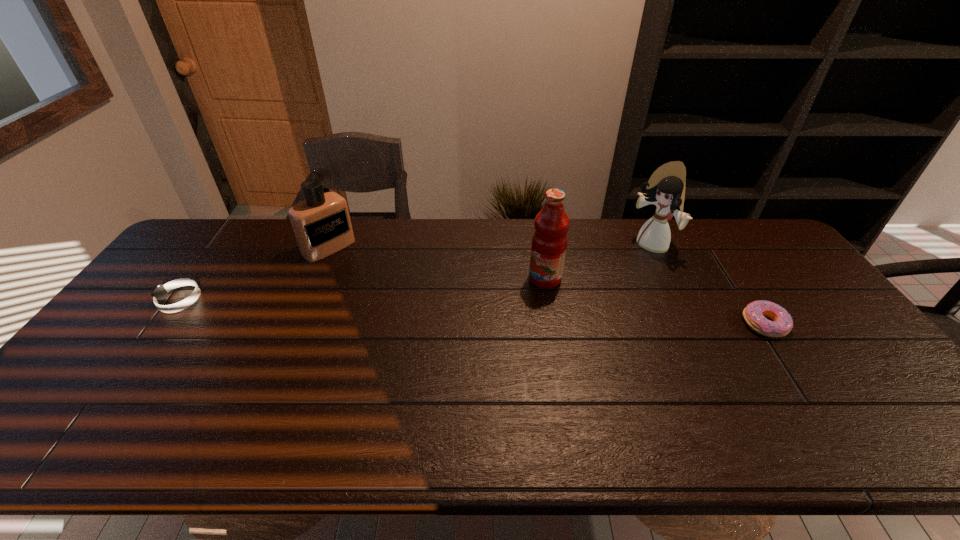
Find the location of a particular element. The image size is (960, 540). free point between the leftmost object and the doughnut is located at coordinates (472, 312).

The image size is (960, 540). What are the coordinates of `free space between the wristband and the fruit juice` in the screenshot? It's located at (363, 289).

Find the location of a particular element. The width and height of the screenshot is (960, 540). free space between the wristband and the perfume is located at coordinates (254, 274).

In order to click on vacant point located between the leftmost object and the fruit juice in this screenshot , I will do `click(363, 289)`.

Image resolution: width=960 pixels, height=540 pixels. In order to click on free space between the second object from right to left and the fruit juice in this screenshot , I will do `click(598, 262)`.

I want to click on empty location between the third shortest object and the third object from left to right, so click(437, 263).

Where is `the fourth closest object to the leftmost object`? This screenshot has height=540, width=960. the fourth closest object to the leftmost object is located at coordinates (753, 314).

The width and height of the screenshot is (960, 540). Identify the location of object that is the second nearest to the perfume. 549,242.